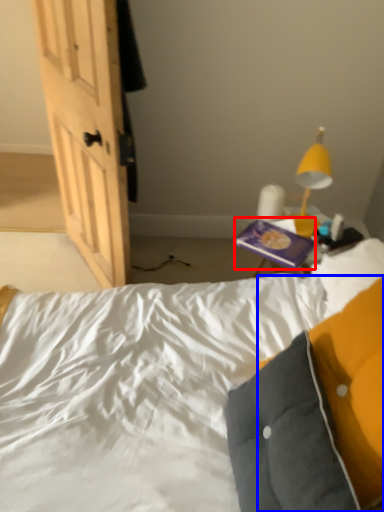
Question: Which object appears farthest to the camera in this image, paperback book (highlighted by a red box) or pillow (highlighted by a blue box)?

Choices:
 (A) paperback book
 (B) pillow

Answer: (A)